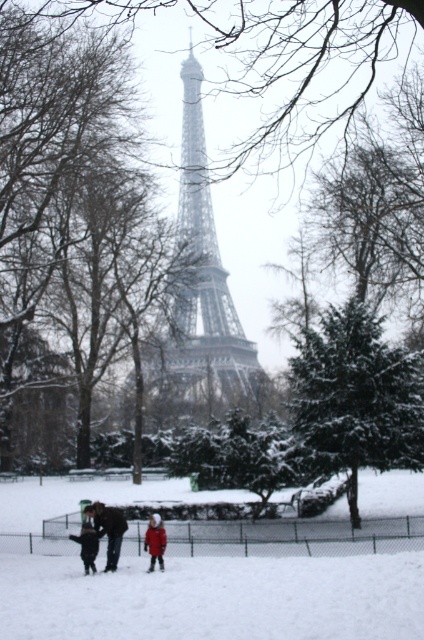
Does point (354, 632) come closer to viewer compared to point (151, 515)?

Yes, point (354, 632) is in front of point (151, 515).

Can you confirm if white fluffy snow at lower center is shorter than red woolen coat at center?

Correct, white fluffy snow at lower center is not as tall as red woolen coat at center.

Where is `white fluffy snow at lower center`? The image size is (424, 640). white fluffy snow at lower center is located at coordinates (214, 598).

This screenshot has width=424, height=640. I want to click on white fluffy snow at lower center, so click(214, 598).

Who is more forward, (x=214, y=570) or (x=184, y=385)?

Positioned in front is point (x=214, y=570).

Identify the location of white fluffy snow at lower center. coord(214,598).

At what (x,y) coordinates should I click in order to perform the action: click on white fluffy snow at lower center. Please return your answer as a coordinate pair (x, y). Looking at the image, I should click on (214, 598).

Between white fluffy snow at lower center and dark gray coat at lower left, which one has more height?

Standing taller between the two is white fluffy snow at lower center.

Where is `white fluffy snow at lower center`? white fluffy snow at lower center is located at coordinates (214, 598).

Who is more forward, (345,588) or (81,532)?

Point (345,588) is in front.

The width and height of the screenshot is (424, 640). I want to click on white fluffy snow at lower center, so click(214, 598).